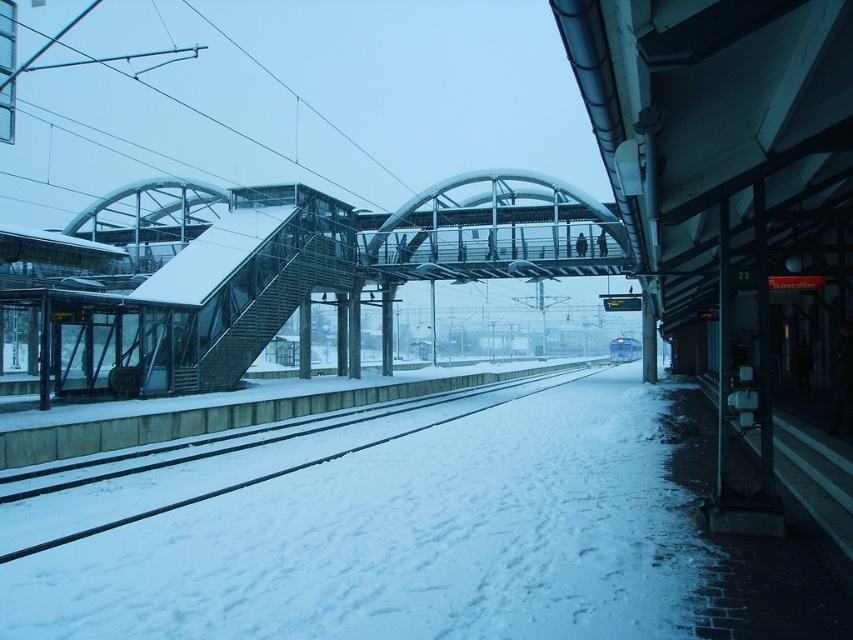
Does snow-covered tracks at center have a greater height compared to blue glossy train at center?

In fact, snow-covered tracks at center may be shorter than blue glossy train at center.

Which is more to the left, snow-covered tracks at center or blue glossy train at center?

snow-covered tracks at center is more to the left.

Identify the location of snow-covered tracks at center. (225, 467).